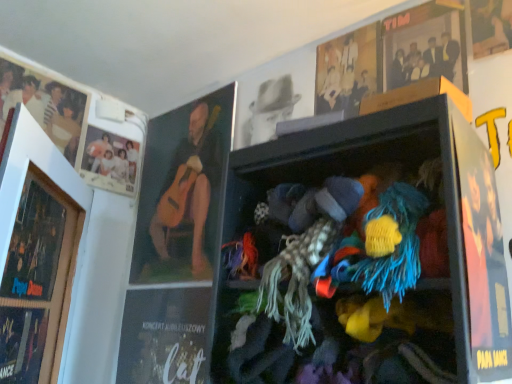
Question: Can you confirm if matte black magazine at lower left, which is the first magazine from left to right, is wider than wooden picture frame at left?

Choices:
 (A) yes
 (B) no

Answer: (B)

Question: Does matte black magazine at lower left, which is the first magazine from left to right, have a larger size compared to wooden picture frame at left?

Choices:
 (A) yes
 (B) no

Answer: (B)

Question: Is matte black magazine at lower left, which is the 1th magazine from front to back, smaller than wooden picture frame at left?

Choices:
 (A) yes
 (B) no

Answer: (A)

Question: From a real-world perspective, is matte black magazine at lower left, positioned as the 2th magazine in right-to-left order, under wooden picture frame at left?

Choices:
 (A) no
 (B) yes

Answer: (B)

Question: Is matte black magazine at lower left, which is the second magazine in back-to-front order, looking in the opposite direction of wooden picture frame at left?

Choices:
 (A) no
 (B) yes

Answer: (B)

Question: Considering the relative positions of oil-painted guitar at upper left, which is the 3th person in left-to-right order, and matte white photo at upper left, the second person from the left, in the image provided, is oil-painted guitar at upper left, which is the 3th person in left-to-right order, to the left or to the right of matte white photo at upper left, the second person from the left,?

Choices:
 (A) right
 (B) left

Answer: (A)

Question: Considering the positions of oil-painted guitar at upper left, which appears as the 2th person when viewed from the right, and matte white photo at upper left, the 3th person in the right-to-left sequence, in the image, is oil-painted guitar at upper left, which appears as the 2th person when viewed from the right, taller or shorter than matte white photo at upper left, the 3th person in the right-to-left sequence,?

Choices:
 (A) short
 (B) tall

Answer: (B)

Question: Is oil-painted guitar at upper left, which is the 3th person in left-to-right order, situated inside matte white photo at upper left, the 3th person in the right-to-left sequence, or outside?

Choices:
 (A) inside
 (B) outside

Answer: (B)

Question: Is point (198, 105) closer or farther from the camera than point (117, 144)?

Choices:
 (A) closer
 (B) farther

Answer: (A)

Question: From the image's perspective, is matte black magazine at lower left, which is the 1th magazine from front to back, positioned above or below matte black poster at right?

Choices:
 (A) below
 (B) above

Answer: (A)

Question: From a real-world perspective, is matte black magazine at lower left, positioned as the 2th magazine in right-to-left order, above or below matte black poster at right?

Choices:
 (A) above
 (B) below

Answer: (B)

Question: In the image, is matte black magazine at lower left, which is the first magazine from left to right, on the left side or the right side of matte black poster at right?

Choices:
 (A) left
 (B) right

Answer: (A)

Question: Considering the positions of matte black magazine at lower left, which is the first magazine from left to right, and matte black poster at right in the image, is matte black magazine at lower left, which is the first magazine from left to right, taller or shorter than matte black poster at right?

Choices:
 (A) short
 (B) tall

Answer: (A)

Question: Is point (45, 352) positioned closer to the camera than point (330, 49)?

Choices:
 (A) closer
 (B) farther

Answer: (A)

Question: Is wooden picture frame at left taller or shorter than light brown wooden frame at upper center, which is counted as the 1th person, starting from the right?

Choices:
 (A) short
 (B) tall

Answer: (B)